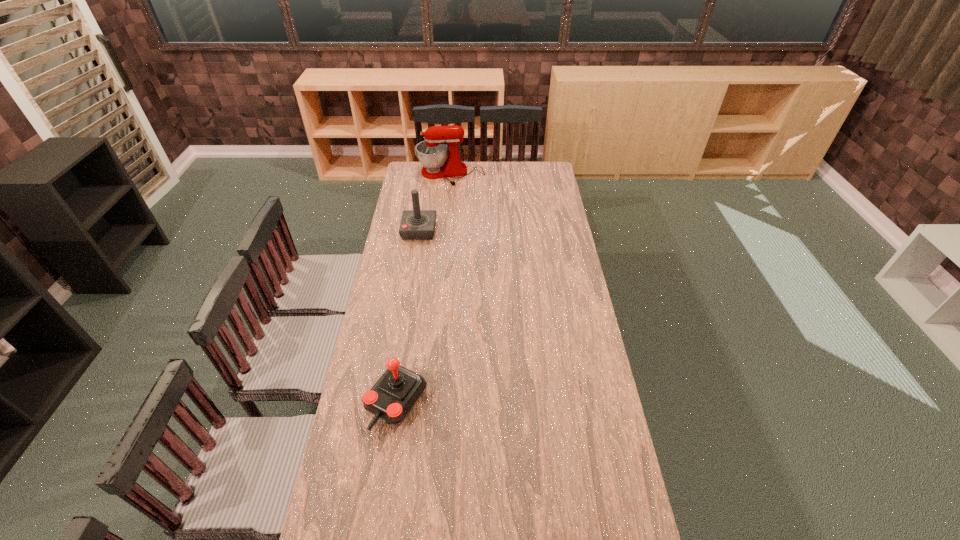
Image resolution: width=960 pixels, height=540 pixels. Find the location of `mixer`. mixer is located at coordinates (432, 152).

Locate an element on the screen. The height and width of the screenshot is (540, 960). the farthest object is located at coordinates (432, 152).

The image size is (960, 540). What are the coordinates of `the farther joystick` in the screenshot? It's located at (416, 224).

Image resolution: width=960 pixels, height=540 pixels. Identify the location of the nearer joystick. (397, 391).

The height and width of the screenshot is (540, 960). In order to click on vacant space located 0.210m on the bowl side of the farthest object in this screenshot , I will do `click(447, 208)`.

Locate an element on the screen. The height and width of the screenshot is (540, 960). vacant space located on the rectangular base of the second farthest object is located at coordinates (454, 230).

Where is `free space located 0.180m on the front of the nearest object`? This screenshot has width=960, height=540. free space located 0.180m on the front of the nearest object is located at coordinates (382, 496).

I want to click on object that is at the far edge, so click(432, 152).

Locate an element on the screen. This screenshot has width=960, height=540. mixer positioned at the left edge is located at coordinates (432, 152).

At what (x,y) coordinates should I click in order to perform the action: click on object that is positioned at the far left corner. Please return your answer as a coordinate pair (x, y). The width and height of the screenshot is (960, 540). Looking at the image, I should click on [432, 152].